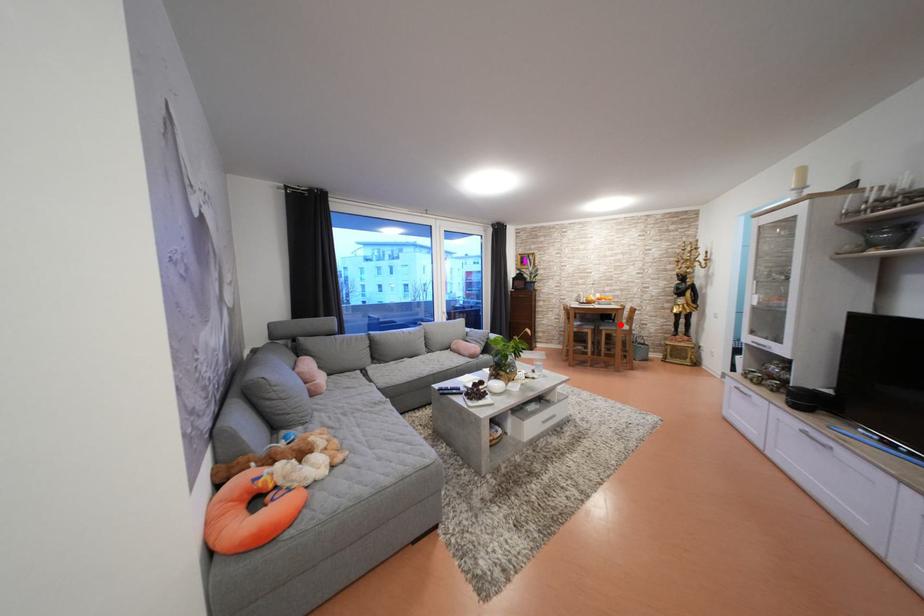
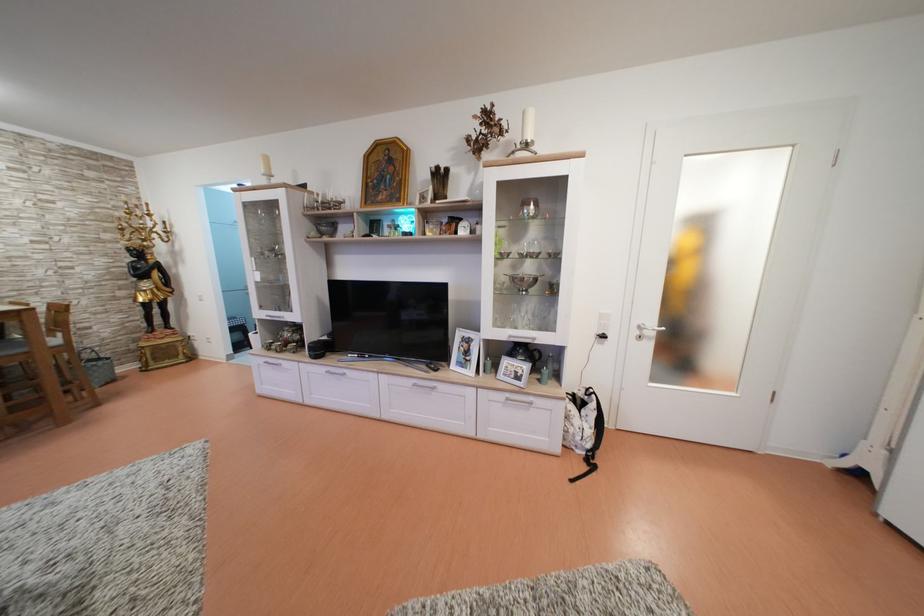
Find the pixel in the second image that matches the highlighted location in the first image.

(7, 339)